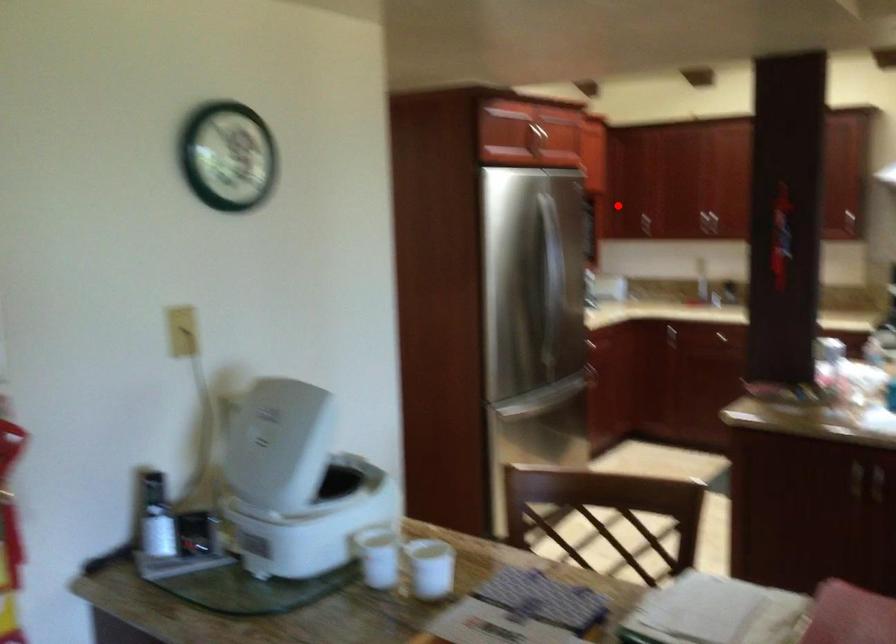
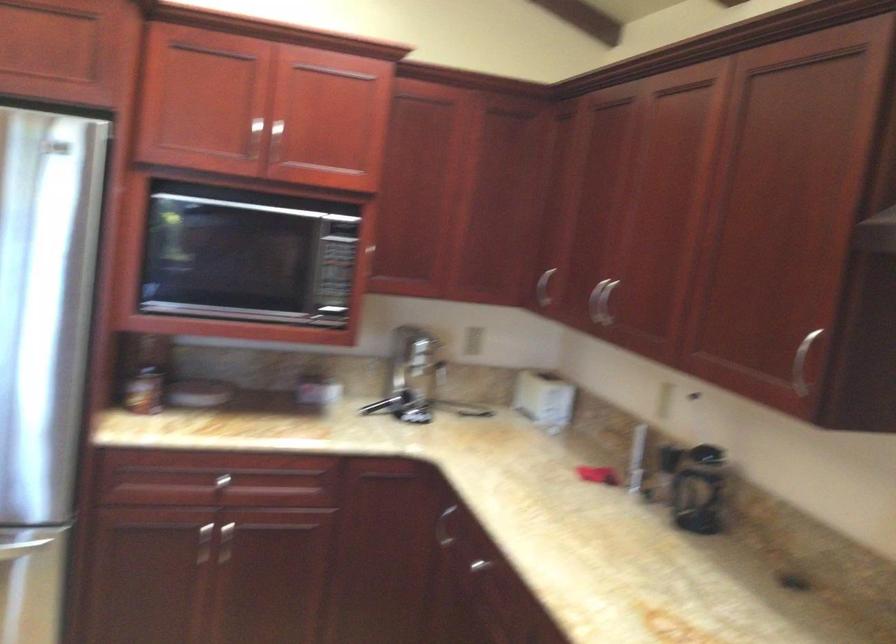
Question: I am providing you with two images of the same scene from different viewpoints. In image1, a red point is highlighted. Considering the same 3D point in image2, which of the following is correct?

Choices:
 (A) It is closer
 (B) It is farther

Answer: (A)